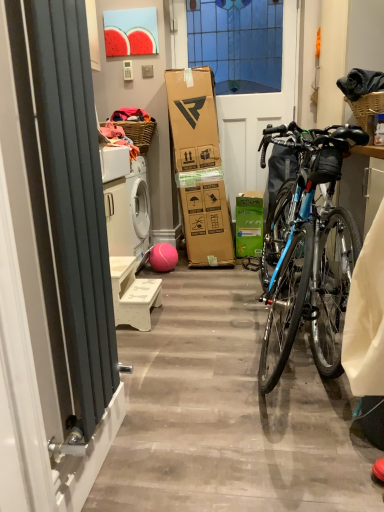
Question: From the image's perspective, is white plastic power outlet at upper center located above rubber ball at center?

Choices:
 (A) no
 (B) yes

Answer: (B)

Question: Is white plastic power outlet at upper center next to rubber ball at center?

Choices:
 (A) no
 (B) yes

Answer: (A)

Question: From a real-world perspective, is white plastic power outlet at upper center under rubber ball at center?

Choices:
 (A) yes
 (B) no

Answer: (B)

Question: Does white plastic power outlet at upper center have a lesser width compared to rubber ball at center?

Choices:
 (A) yes
 (B) no

Answer: (A)

Question: Does white plastic power outlet at upper center have a greater height compared to rubber ball at center?

Choices:
 (A) yes
 (B) no

Answer: (B)

Question: From the image's perspective, is woven brown picnic basket at upper center, the second picnic basket viewed from the front, positioned above or below white matte bench at lower center?

Choices:
 (A) below
 (B) above

Answer: (B)

Question: Looking at their shapes, would you say woven brown picnic basket at upper center, which ranks as the second picnic basket in right-to-left order, is wider or thinner than white matte bench at lower center?

Choices:
 (A) wide
 (B) thin

Answer: (A)

Question: In the image, is woven brown picnic basket at upper center, which ranks as the second picnic basket in right-to-left order, positioned in front of or behind white matte bench at lower center?

Choices:
 (A) behind
 (B) front

Answer: (A)

Question: From a real-world perspective, is woven brown picnic basket at upper center, positioned as the first picnic basket in back-to-front order, above or below white matte bench at lower center?

Choices:
 (A) below
 (B) above

Answer: (B)

Question: In the image, is woven brown picnic basket at upper center, the second picnic basket viewed from the front, on the left side or the right side of white plastic power outlet at upper center?

Choices:
 (A) left
 (B) right

Answer: (A)

Question: Considering the positions of woven brown picnic basket at upper center, which ranks as the second picnic basket in right-to-left order, and white plastic power outlet at upper center in the image, is woven brown picnic basket at upper center, which ranks as the second picnic basket in right-to-left order, bigger or smaller than white plastic power outlet at upper center?

Choices:
 (A) small
 (B) big

Answer: (B)

Question: Considering the positions of woven brown picnic basket at upper center, which is counted as the 1th picnic basket, starting from the left, and white plastic power outlet at upper center in the image, is woven brown picnic basket at upper center, which is counted as the 1th picnic basket, starting from the left, taller or shorter than white plastic power outlet at upper center?

Choices:
 (A) short
 (B) tall

Answer: (B)

Question: Considering their positions, is woven brown picnic basket at upper center, positioned as the first picnic basket in back-to-front order, located in front of or behind white plastic power outlet at upper center?

Choices:
 (A) behind
 (B) front

Answer: (B)

Question: From their relative heights in the image, would you say woven brown picnic basket at upper center, the second picnic basket viewed from the front, is taller or shorter than rubber ball at center?

Choices:
 (A) tall
 (B) short

Answer: (B)

Question: Is point (139, 141) closer or farther from the camera than point (168, 245)?

Choices:
 (A) farther
 (B) closer

Answer: (B)